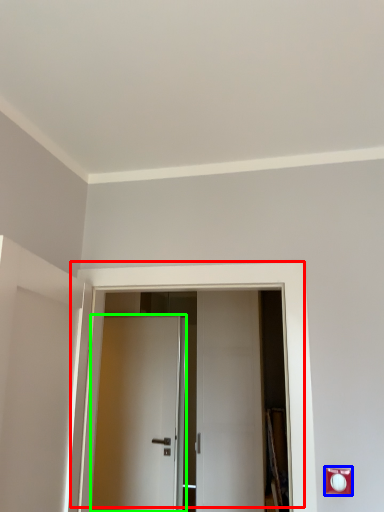
Question: Considering the real-world distances, which object is closest to door (highlighted by a red box)? electric outlet (highlighted by a blue box) or door (highlighted by a green box).

Choices:
 (A) electric outlet
 (B) door

Answer: (A)